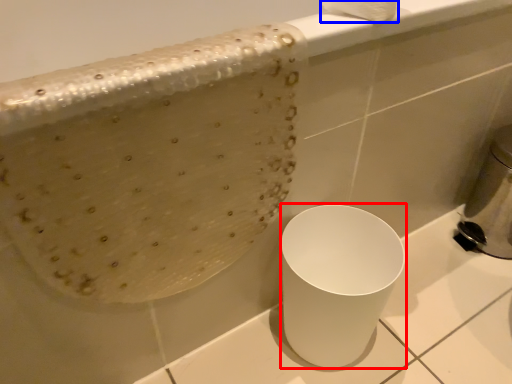
Question: Which of the following is the closest to the observer, porcelain (highlighted by a red box) or toilet paper (highlighted by a blue box)?

Choices:
 (A) porcelain
 (B) toilet paper

Answer: (B)